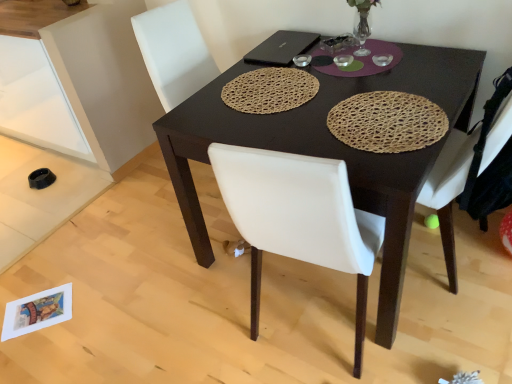
Question: Does black matte laptop at upper center have a greater width compared to dark brown wooden desk at center?

Choices:
 (A) yes
 (B) no

Answer: (B)

Question: Considering the relative sizes of black matte laptop at upper center and dark brown wooden desk at center in the image provided, is black matte laptop at upper center shorter than dark brown wooden desk at center?

Choices:
 (A) no
 (B) yes

Answer: (B)

Question: Is black matte laptop at upper center at the right side of dark brown wooden desk at center?

Choices:
 (A) no
 (B) yes

Answer: (A)

Question: Is black matte laptop at upper center looking in the opposite direction of dark brown wooden desk at center?

Choices:
 (A) yes
 (B) no

Answer: (A)

Question: Can you confirm if black matte laptop at upper center is bigger than dark brown wooden desk at center?

Choices:
 (A) no
 (B) yes

Answer: (A)

Question: Considering the positions of woven straw placemat at center, marked as the first mat in a right-to-left arrangement, and black matte laptop at upper center in the image, is woven straw placemat at center, marked as the first mat in a right-to-left arrangement, wider or thinner than black matte laptop at upper center?

Choices:
 (A) wide
 (B) thin

Answer: (A)

Question: From the image's perspective, is woven straw placemat at center, marked as the first mat in a right-to-left arrangement, above or below black matte laptop at upper center?

Choices:
 (A) below
 (B) above

Answer: (A)

Question: Is woven straw placemat at center, the 2th mat when ordered from left to right, inside the boundaries of black matte laptop at upper center, or outside?

Choices:
 (A) outside
 (B) inside

Answer: (A)

Question: Is woven straw placemat at center, the 2th mat when ordered from left to right, taller or shorter than black matte laptop at upper center?

Choices:
 (A) tall
 (B) short

Answer: (B)

Question: From their relative heights in the image, would you say matte white cabinet at lower left is taller or shorter than woven brown placemat at center, the 2th mat from the right?

Choices:
 (A) short
 (B) tall

Answer: (B)

Question: Is matte white cabinet at lower left situated inside woven brown placemat at center, the 1th mat positioned from the left, or outside?

Choices:
 (A) inside
 (B) outside

Answer: (B)

Question: Is matte white cabinet at lower left in front of or behind woven brown placemat at center, the 1th mat positioned from the left, in the image?

Choices:
 (A) front
 (B) behind

Answer: (B)

Question: From the image's perspective, relative to woven brown placemat at center, the 2th mat from the right, is matte white cabinet at lower left above or below?

Choices:
 (A) below
 (B) above

Answer: (B)

Question: Is woven brown placemat at center, the 2th mat from the right, wider or thinner than black matte laptop at upper center?

Choices:
 (A) thin
 (B) wide

Answer: (B)

Question: From the image's perspective, is woven brown placemat at center, the 2th mat from the right, positioned above or below black matte laptop at upper center?

Choices:
 (A) below
 (B) above

Answer: (A)